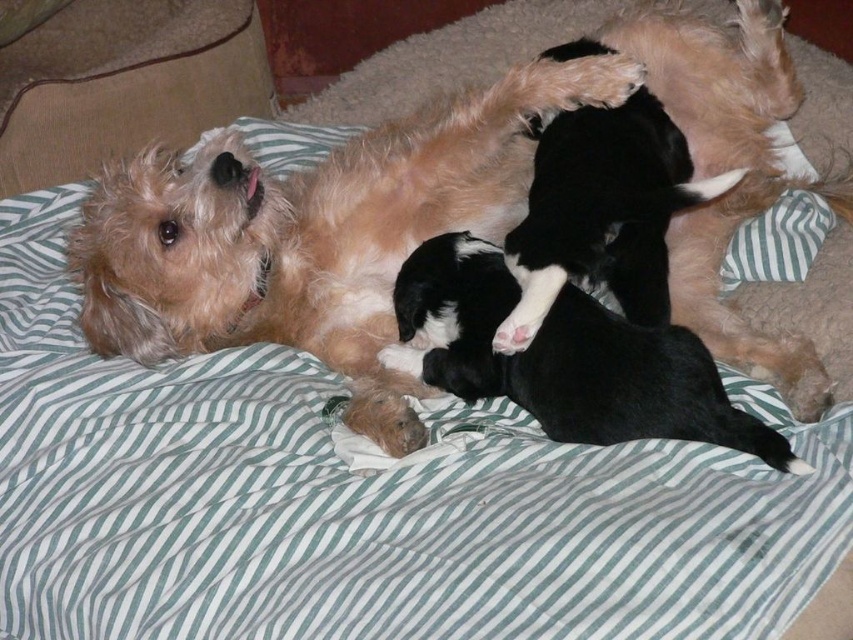
You are a toy that is 10 inches long. You are placed on the beige carpet in the scene. You want to move from the fuzzy brown dog at upper left to the black soft fur at center. Can you fit through the space between them without bending or moving the objects?

The distance between the fuzzy brown dog at upper left and the black soft fur at center is 8.50 inches. Since the toy is 10 inches long, it cannot fit through the space between them without bending or moving the objects.